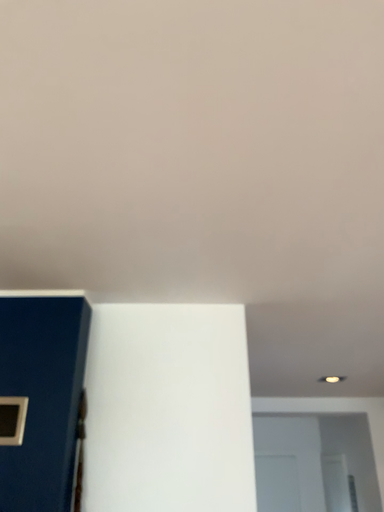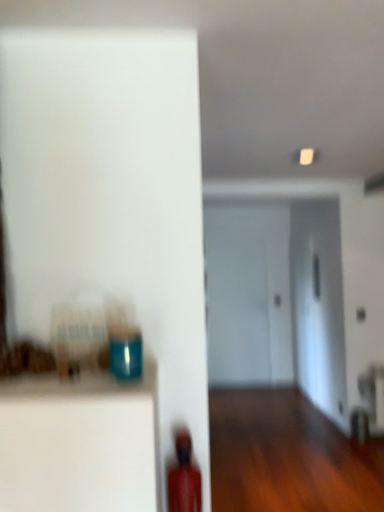
Question: How did the camera likely rotate when shooting the video?

Choices:
 (A) rotated upward
 (B) rotated downward

Answer: (B)